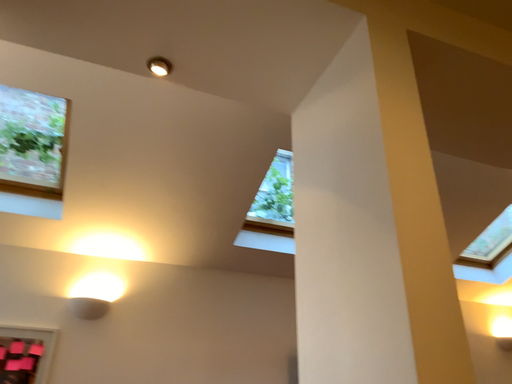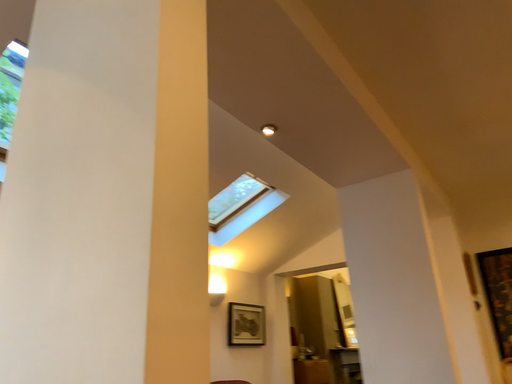
Question: How did the camera likely rotate when shooting the video?

Choices:
 (A) rotated left
 (B) rotated right

Answer: (B)